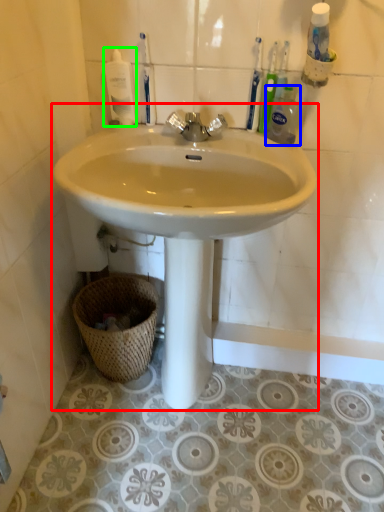
Question: Which is farther away from sink (highlighted by a red box)? cleaning product (highlighted by a blue box) or mouthwash (highlighted by a green box)?

Choices:
 (A) cleaning product
 (B) mouthwash

Answer: (B)